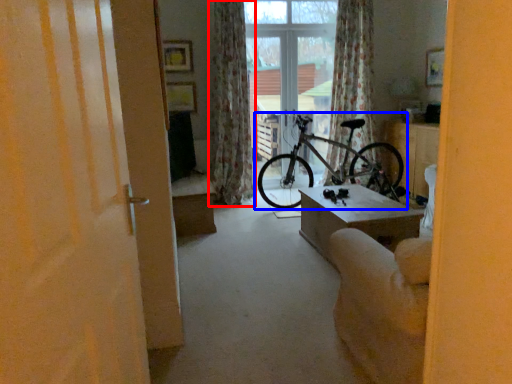
Question: Which object is further to the camera taking this photo, curtain (highlighted by a red box) or bicycle (highlighted by a blue box)?

Choices:
 (A) curtain
 (B) bicycle

Answer: (A)